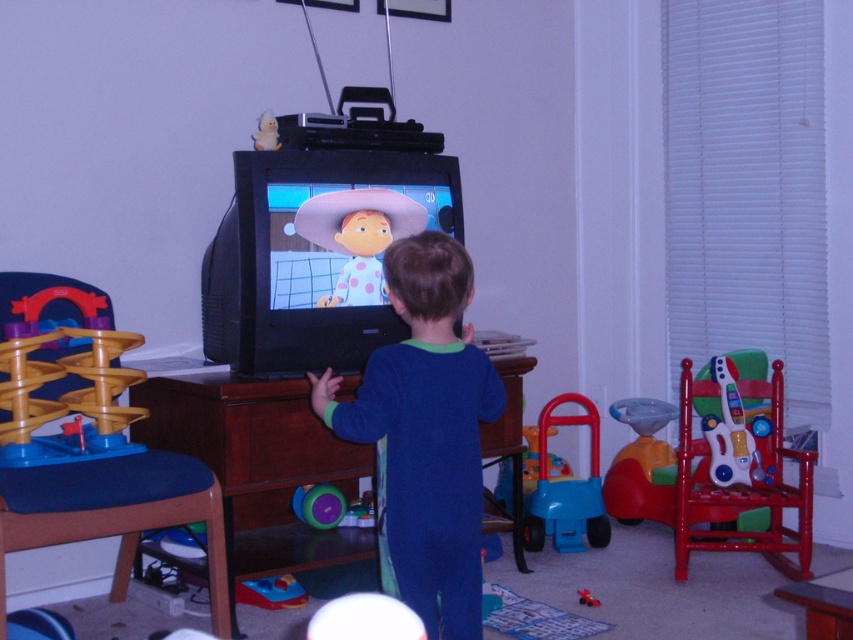
Question: In this image, where is brown wood dresser at center located relative to purple rubber ball at lower center?

Choices:
 (A) left
 (B) right

Answer: (A)

Question: Can you confirm if rubberized plastic walker at lower center is bigger than translucent plastic guitar at right?

Choices:
 (A) yes
 (B) no

Answer: (A)

Question: Does wooden plastic track at left have a larger size compared to purple rubber ball at lower center?

Choices:
 (A) yes
 (B) no

Answer: (A)

Question: Among these points, which one is nearest to the camera?

Choices:
 (A) (735, 456)
 (B) (596, 604)
 (C) (259, 129)

Answer: (B)

Question: Based on their relative distances, which object is nearer to the polka dot fabric cowboy hat at upper center?

Choices:
 (A) brown wood dresser at center
 (B) wooden drawer at center

Answer: (B)

Question: Which object is positioned farthest from the red plastic guitar at right?

Choices:
 (A) wooden plastic track at left
 (B) polka dot fabric cowboy hat at upper center

Answer: (A)